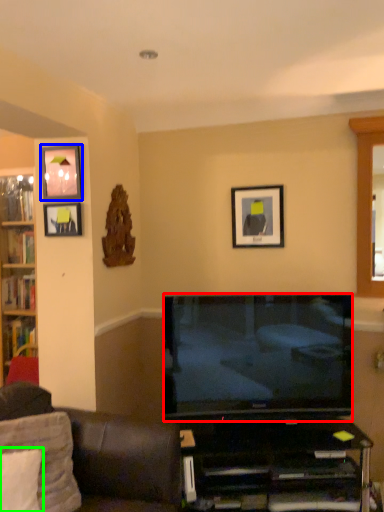
Question: Which object is the farthest from television (highlighted by a red box)? Choose among these: picture frame (highlighted by a blue box) or pillow (highlighted by a green box).

Choices:
 (A) picture frame
 (B) pillow

Answer: (A)